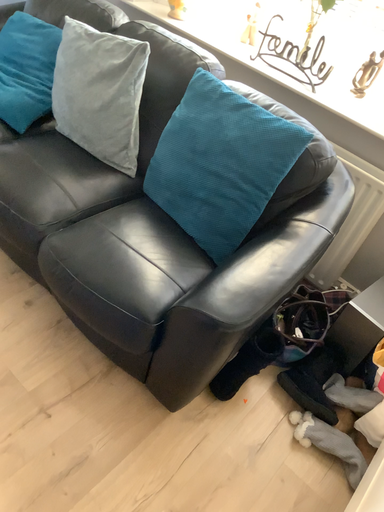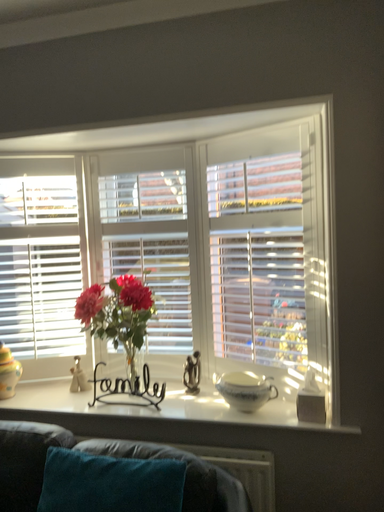
Question: Which way did the camera rotate in the video?

Choices:
 (A) rotated left
 (B) rotated right

Answer: (B)